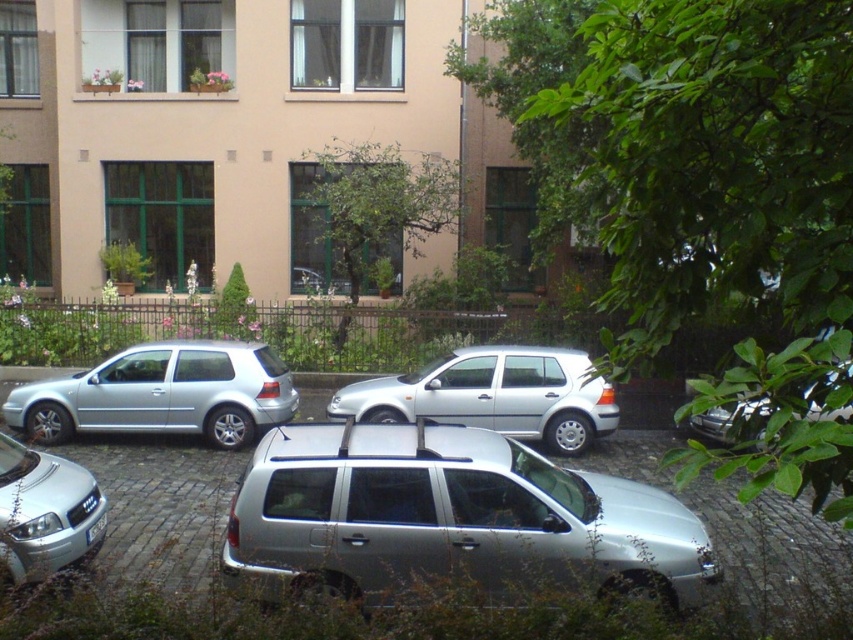
You are standing at the point with coordinates point (844, 408) and want to walk to the point with coordinates point (260, 400). Which direction should you move relative to your current position?

You should move forward because point (260, 400) is behind point (844, 408), meaning it is in the direction you are facing if you are at point (844, 408).

You are a delivery driver who needs to park your truck, which is 5 meters long, in this residential area. Looking at the satin silver suv at center and the metallic silver car at right, which vehicle takes up more space in the parking spot?

The metallic silver car at right takes up more space in the parking spot because it is larger than the satin silver suv at center.